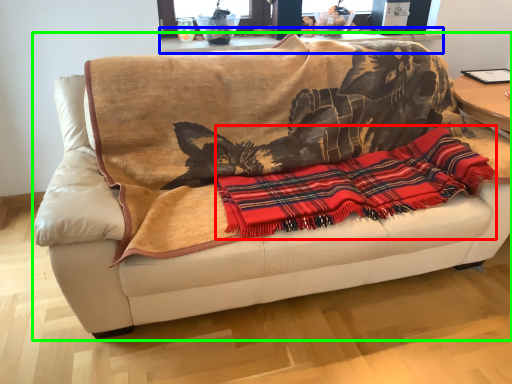
Question: Based on their relative distances, which object is farther from cloth (highlighted by a red box)? Choose from table (highlighted by a blue box) and studio couch (highlighted by a green box).

Choices:
 (A) table
 (B) studio couch

Answer: (A)